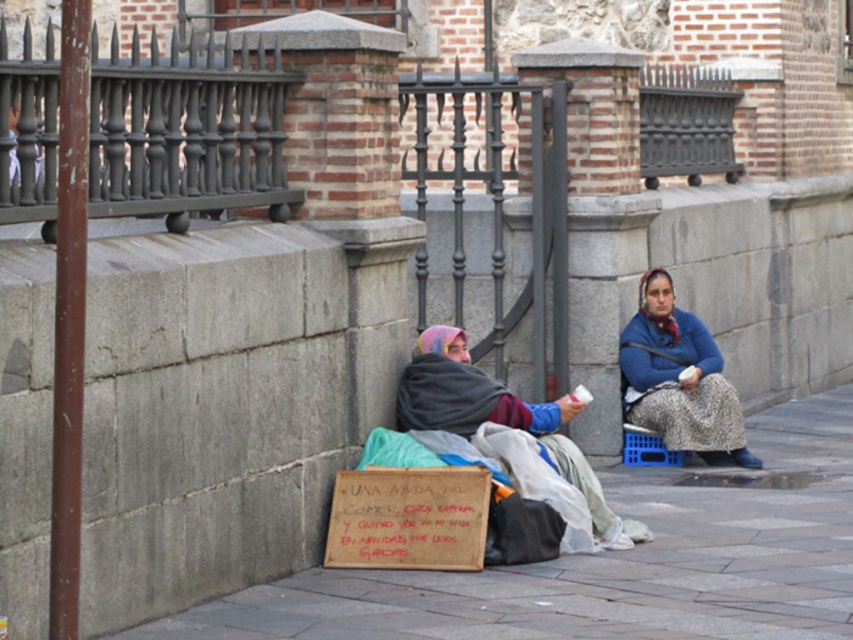
You are a delivery robot that needs to place a food package on the gray concrete pavement at lower center. However, there is a brown cardboard sign at lower center in the way. Can you move the sign to the side to access the pavement?

The gray concrete pavement at lower center is larger than the brown cardboard sign at lower center, so you can move the brown cardboard sign at lower center to the side to access the pavement.

You are standing at the camera position and see the point at coordinates [672,413]. If you walk straight towards it, how far will you have to walk to reach that point?

The point at coordinates [672,413] is 14.36 meters away from the camera, so you will have to walk 14.36 meters to reach it.